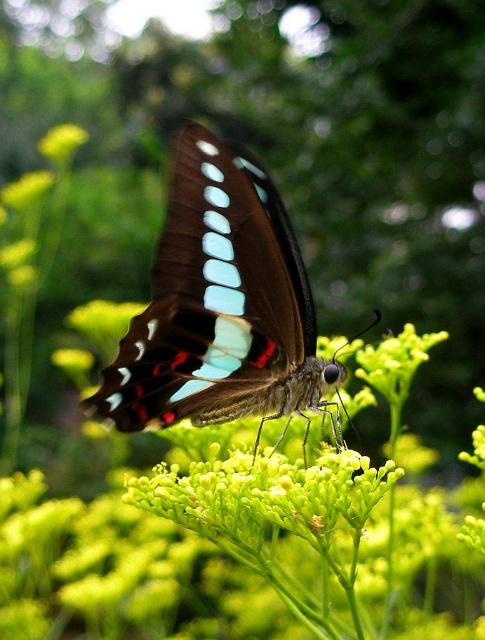
Does point (205, 403) come farther from viewer compared to point (69, 150)?

No, it is in front of (69, 150).

Which is below, shiny brown butterfly at center or green matte flower at upper left?

Positioned lower is shiny brown butterfly at center.

The image size is (485, 640). Find the location of `shiny brown butterfly at center`. shiny brown butterfly at center is located at coordinates (220, 307).

The image size is (485, 640). Identify the location of shiny brown butterfly at center. (220, 307).